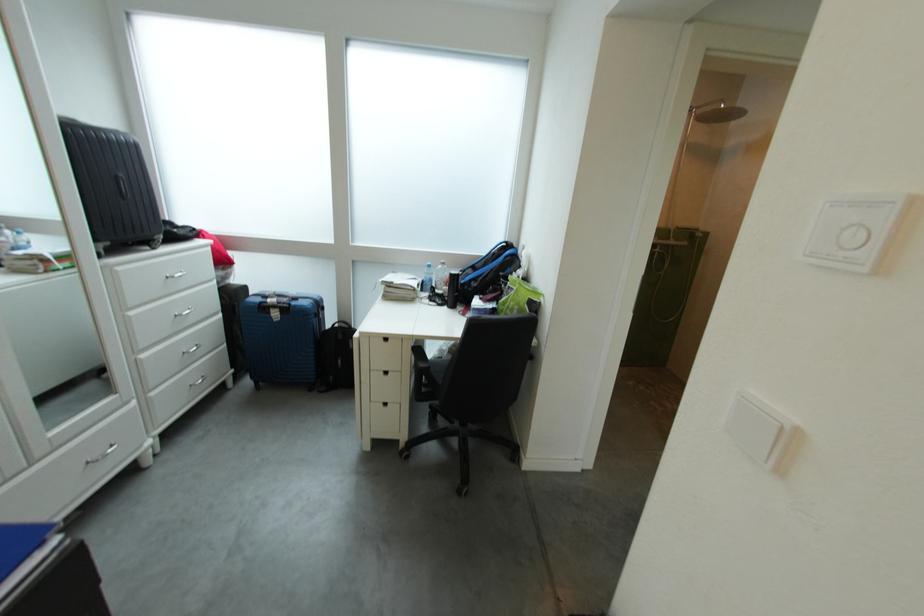
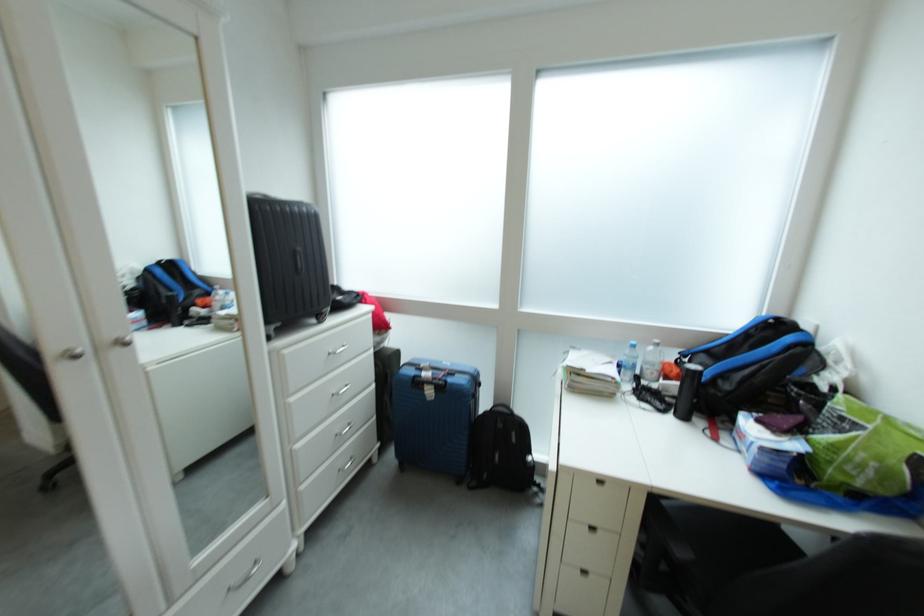
Locate, in the second image, the point that corresponds to point 281,315 in the first image.

(434, 392)